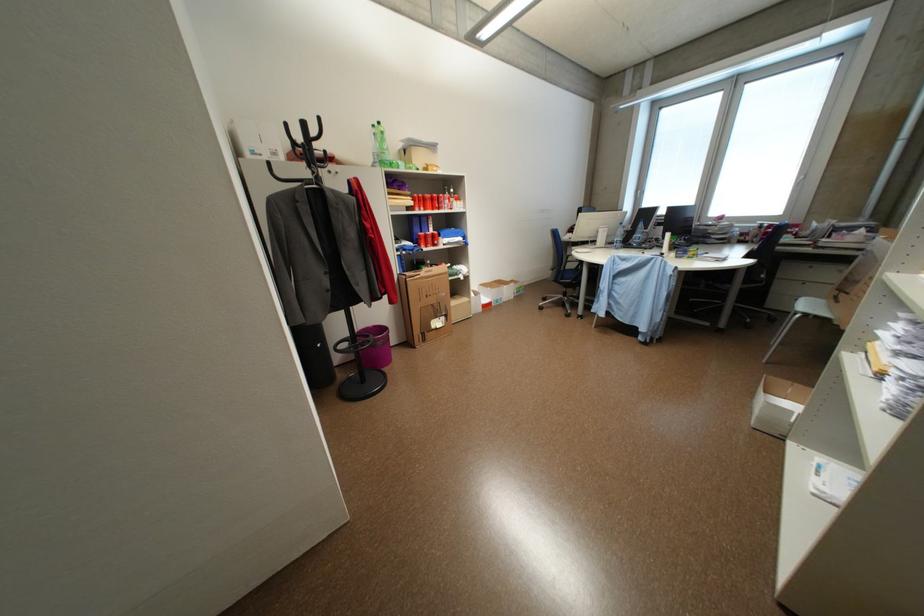
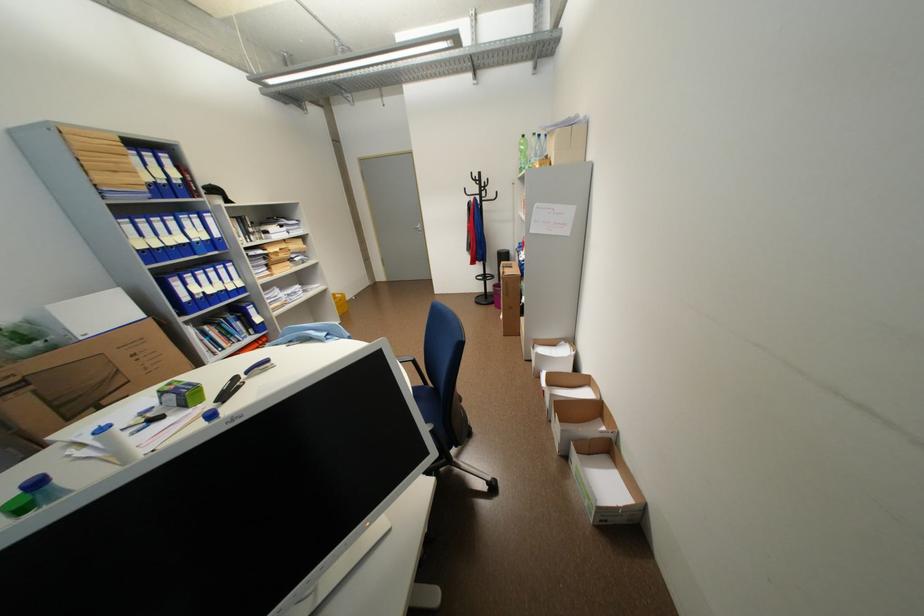
Where in the second image is the point corresponding to (x=387, y=124) from the first image?

(531, 137)